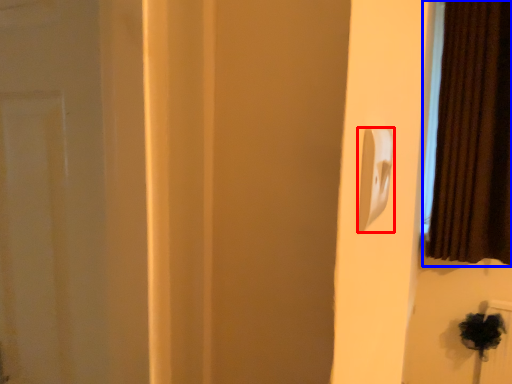
Question: Which point is closer to the camera, light switch (highlighted by a red box) or curtain (highlighted by a blue box)?

Choices:
 (A) light switch
 (B) curtain

Answer: (A)